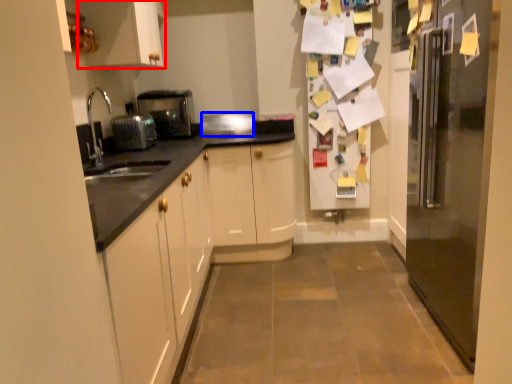
Question: Which object is closer to the camera taking this photo, cabinetry (highlighted by a red box) or appliance (highlighted by a blue box)?

Choices:
 (A) cabinetry
 (B) appliance

Answer: (A)